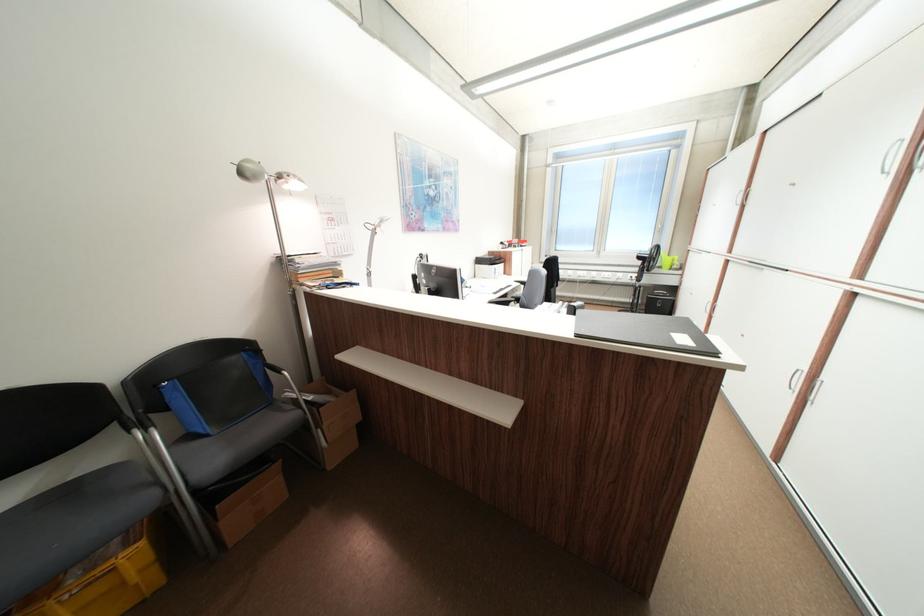
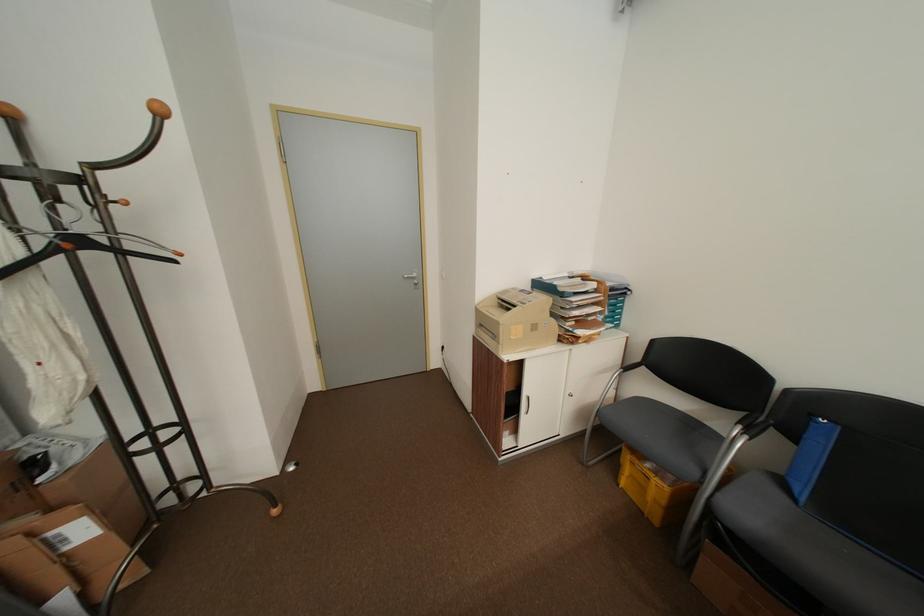
Where in the second image is the point corresponding to [215,436] from the first image?

(804, 500)